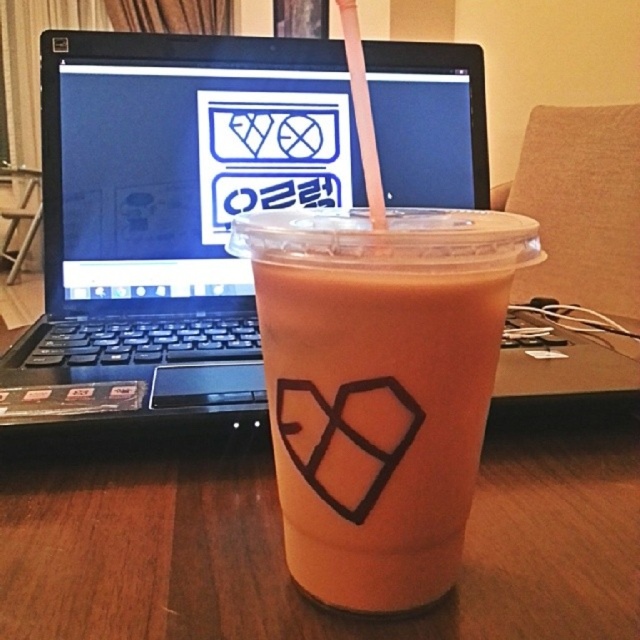
You are organizing items on a desk and need to place both the black plastic laptop at center and the transparent plastic straw at upper center. Since the desk space is limited, which item should you prioritize placing first to ensure both fit?

The black plastic laptop at center is bigger than the transparent plastic straw at upper center, so you should prioritize placing the black plastic laptop at center first to ensure there is enough space for both items.

You are organizing items on a shelf and need to place the translucent plastic cup at center and the transparent plastic straw at upper center. If the shelf space is limited, which item should you remove to free up more space?

The translucent plastic cup at center occupies less space than the transparent plastic straw at upper center, so you should remove the transparent plastic straw at upper center to free up more space.

You are organizing items on a desk and need to place a new item between the black plastic laptop at center and the translucent plastic cup at center. Based on their positions, which object should you place the new item closer to?

The new item should be placed closer to the translucent plastic cup at center because the black plastic laptop at center is to the left of the translucent plastic cup at center, meaning there is more space to the right of the cup.